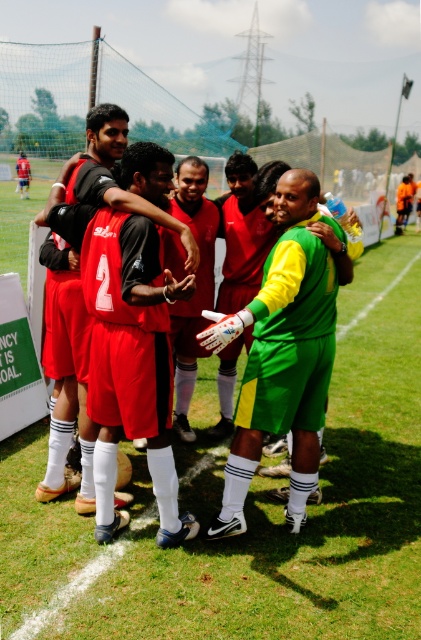
Is matte red shorts at center wider than green matte jersey at center?

Indeed, matte red shorts at center has a greater width compared to green matte jersey at center.

Where is `matte red shorts at center`? The image size is (421, 640). matte red shorts at center is located at coordinates (127, 355).

This screenshot has width=421, height=640. What do you see at coordinates (127, 355) in the screenshot? I see `matte red shorts at center` at bounding box center [127, 355].

In order to click on matte red shorts at center in this screenshot , I will do `click(127, 355)`.